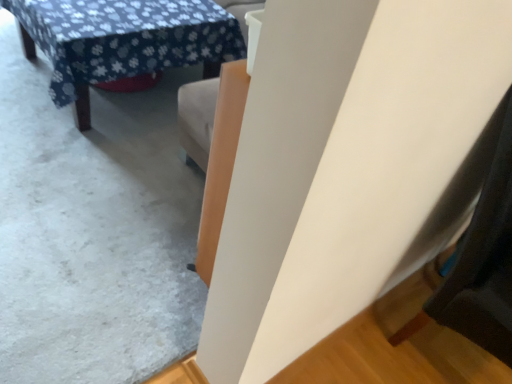
Question: Is white matte wall at upper center wider or thinner than blue floral fabric table at upper left?

Choices:
 (A) thin
 (B) wide

Answer: (B)

Question: Is white matte wall at upper center in front of or behind blue floral fabric table at upper left in the image?

Choices:
 (A) behind
 (B) front

Answer: (B)

Question: Is white matte wall at upper center situated inside blue floral fabric table at upper left or outside?

Choices:
 (A) inside
 (B) outside

Answer: (B)

Question: From their relative heights in the image, would you say blue floral fabric table at upper left is taller or shorter than white matte wall at upper center?

Choices:
 (A) short
 (B) tall

Answer: (B)

Question: From the image's perspective, is blue floral fabric table at upper left above or below white matte wall at upper center?

Choices:
 (A) above
 (B) below

Answer: (A)

Question: Does point (139, 28) appear closer or farther from the camera than point (32, 77)?

Choices:
 (A) closer
 (B) farther

Answer: (A)

Question: Is blue floral fabric table at upper left in front of or behind white matte wall at upper center in the image?

Choices:
 (A) front
 (B) behind

Answer: (B)